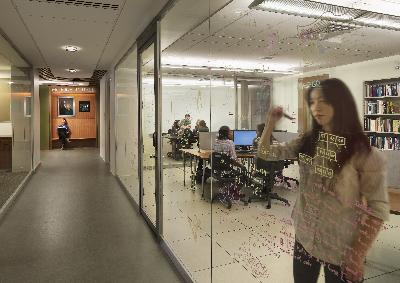
I want to click on bookshel, so click(x=382, y=114).